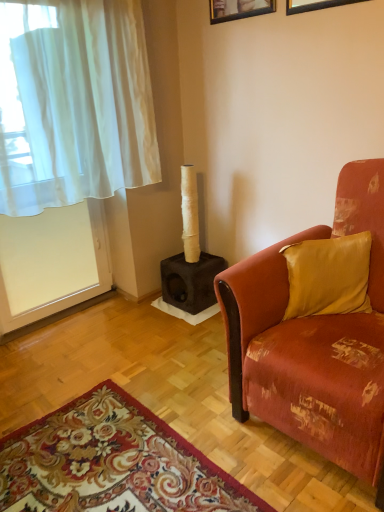
At what (x,y) coordinates should I click in order to perform the action: click on free spot below white sheer curtain at left (from a real-world perspective). Please return your answer as a coordinate pair (x, y). This screenshot has height=512, width=384. Looking at the image, I should click on (101, 331).